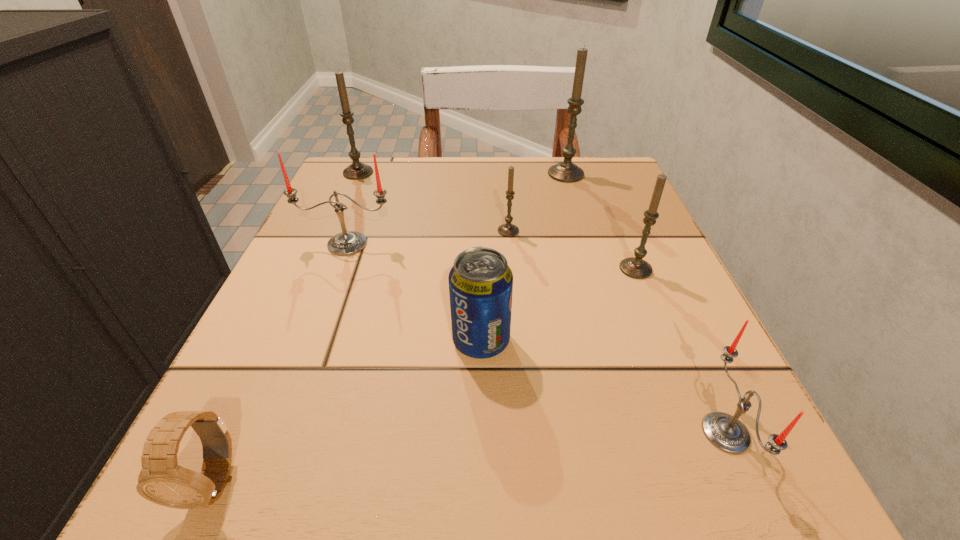
In order to click on free space between the shortest object and the third candle from right to left in this screenshot , I will do `click(390, 328)`.

This screenshot has height=540, width=960. I want to click on free space between the leftmost gray candle and the nearest candle, so click(x=542, y=303).

Locate an element on the screen. This screenshot has height=540, width=960. vacant space that is in between the third candle from right to left and the farther red candle is located at coordinates (457, 209).

The width and height of the screenshot is (960, 540). In order to click on vacant space that is in between the biggest gray candle and the shortest object in this screenshot , I will do `click(390, 328)`.

Find the location of `object that is the fourth closest one to the tallest object`. object that is the fourth closest one to the tallest object is located at coordinates (357, 170).

This screenshot has width=960, height=540. Find the location of `object that is the third closest to the third nearest object`. object that is the third closest to the third nearest object is located at coordinates (635, 267).

Identify which candle is the fifth nearest to the fourth candle from right to left. Please provide its 2D coordinates. Your answer should be formatted as a tuple, i.e. [(x, y)], where the tuple contains the x and y coordinates of a point satisfying the conditions above.

[(724, 431)]

Point out which candle is positioned as the second nearest to the sixth object from left to right. Please provide its 2D coordinates. Your answer should be formatted as a tuple, i.e. [(x, y)], where the tuple contains the x and y coordinates of a point satisfying the conditions above.

[(635, 267)]

Select which gray candle appears as the closest to the watch. Please provide its 2D coordinates. Your answer should be formatted as a tuple, i.e. [(x, y)], where the tuple contains the x and y coordinates of a point satisfying the conditions above.

[(508, 230)]

Find the location of `the second closest gray candle to the sixth farthest object`. the second closest gray candle to the sixth farthest object is located at coordinates (635, 267).